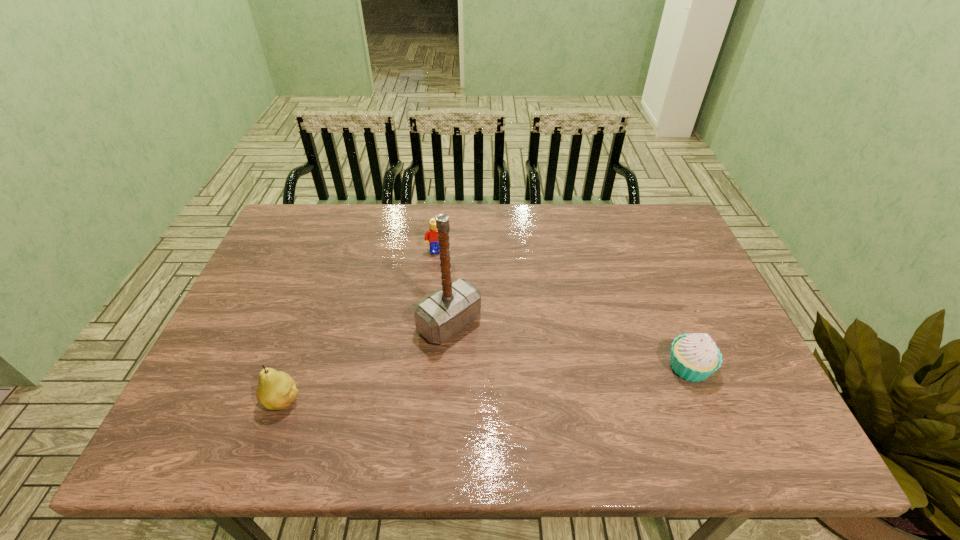
The height and width of the screenshot is (540, 960). I want to click on free spot on the desktop that is between the leftmost object and the cupcake and is positioned on the front-facing side of the farthest object, so click(467, 385).

I want to click on vacant space on the desktop that is between the pear and the cupcake and is positioned on the striking surface of the third nearest object, so click(517, 381).